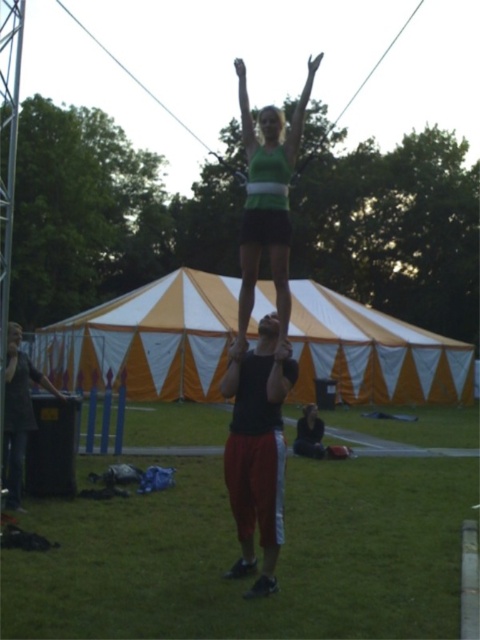
Question: Is dark gray fabric jacket at lower left positioned at the back of matte black head at center?

Choices:
 (A) no
 (B) yes

Answer: (B)

Question: Which point is farther to the camera?

Choices:
 (A) (248, 486)
 (B) (271, 108)
 (C) (48, 381)

Answer: (C)

Question: Can you confirm if yellow/white striped tent at center is bigger than blonde hair at upper center?

Choices:
 (A) no
 (B) yes

Answer: (B)

Question: Can you confirm if yellow/white striped tent at center is positioned to the left of green matte tank top at center?

Choices:
 (A) yes
 (B) no

Answer: (A)

Question: Which of the following is the closest to the observer?

Choices:
 (A) yellow/white striped tent at center
 (B) smooth black hair at center

Answer: (B)

Question: Which object is the farthest from the matte black head at center?

Choices:
 (A) blonde hair at upper center
 (B) dark gray fabric jacket at lower left
 (C) yellow/white striped tent at center

Answer: (C)